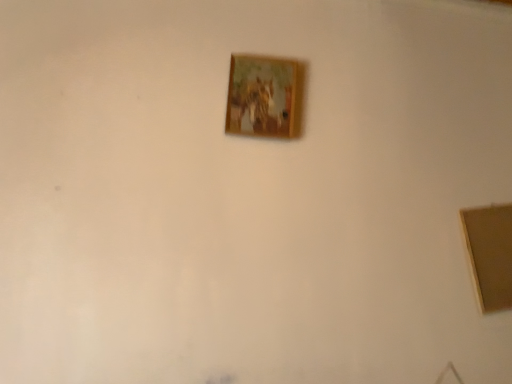
The height and width of the screenshot is (384, 512). Identify the location of wooden frame at center, which is the second picture frame in right-to-left order. (264, 97).

This screenshot has height=384, width=512. Describe the element at coordinates (264, 97) in the screenshot. I see `wooden frame at center, the first picture frame viewed from the top` at that location.

Where is `wooden picture frame at upper center, which appears as the 1th picture frame when viewed from the right`? Image resolution: width=512 pixels, height=384 pixels. wooden picture frame at upper center, which appears as the 1th picture frame when viewed from the right is located at coordinates (490, 254).

This screenshot has width=512, height=384. What do you see at coordinates (490, 254) in the screenshot? I see `wooden picture frame at upper center, placed as the 2th picture frame when sorted from left to right` at bounding box center [490, 254].

Find the location of a particular element. wooden frame at center, which appears as the second picture frame when ordered from the bottom is located at coordinates (264, 97).

Can you confirm if wooden frame at center, the first picture frame viewed from the top, is positioned to the right of wooden picture frame at upper center, marked as the 2th picture frame in a top-to-bottom arrangement?

Incorrect, wooden frame at center, the first picture frame viewed from the top, is not on the right side of wooden picture frame at upper center, marked as the 2th picture frame in a top-to-bottom arrangement.

Is the position of wooden frame at center, which is the second picture frame in right-to-left order, less distant than that of wooden picture frame at upper center, placed as the 2th picture frame when sorted from left to right?

No, wooden frame at center, which is the second picture frame in right-to-left order, is behind wooden picture frame at upper center, placed as the 2th picture frame when sorted from left to right.

Is point (256, 69) farther from viewer compared to point (508, 235)?

No.

From the image's perspective, is wooden frame at center, which appears as the second picture frame when ordered from the bottom, located beneath wooden picture frame at upper center, placed as the 2th picture frame when sorted from left to right?

Incorrect, from the image's perspective, wooden frame at center, which appears as the second picture frame when ordered from the bottom, is higher than wooden picture frame at upper center, placed as the 2th picture frame when sorted from left to right.

From a real-world perspective, does wooden frame at center, the 1th picture frame positioned from the left, sit lower than wooden picture frame at upper center, which appears as the 1th picture frame when viewed from the right?

No.

In the scene shown: Does wooden frame at center, the 1th picture frame positioned from the left, have a lesser width compared to wooden picture frame at upper center, the first picture frame ordered from the bottom?

Correct, the width of wooden frame at center, the 1th picture frame positioned from the left, is less than that of wooden picture frame at upper center, the first picture frame ordered from the bottom.

Which of these two, wooden frame at center, the 1th picture frame positioned from the left, or wooden picture frame at upper center, the first picture frame ordered from the bottom, stands taller?

wooden picture frame at upper center, the first picture frame ordered from the bottom, is taller.

Can you confirm if wooden frame at center, the first picture frame viewed from the top, is smaller than wooden picture frame at upper center, the first picture frame ordered from the bottom?

Yes, wooden frame at center, the first picture frame viewed from the top, is smaller than wooden picture frame at upper center, the first picture frame ordered from the bottom.

Is wooden frame at center, the 1th picture frame positioned from the left, outside of wooden picture frame at upper center, the first picture frame ordered from the bottom?

Yes, wooden frame at center, the 1th picture frame positioned from the left, is outside of wooden picture frame at upper center, the first picture frame ordered from the bottom.

Is wooden frame at center, the first picture frame viewed from the top, not close to wooden picture frame at upper center, marked as the 2th picture frame in a top-to-bottom arrangement?

They are positioned close to each other.

Is wooden frame at center, which is the second picture frame in right-to-left order, oriented towards wooden picture frame at upper center, placed as the 2th picture frame when sorted from left to right?

No, wooden frame at center, which is the second picture frame in right-to-left order, is not oriented towards wooden picture frame at upper center, placed as the 2th picture frame when sorted from left to right.

Measure the distance between wooden frame at center, the first picture frame viewed from the top, and wooden picture frame at upper center, which appears as the 1th picture frame when viewed from the right.

35.54 inches.

Find the location of `picture frame lying on the right of wooden frame at center, the first picture frame viewed from the top`. picture frame lying on the right of wooden frame at center, the first picture frame viewed from the top is located at coordinates (490, 254).

Considering the relative positions of wooden picture frame at upper center, placed as the 2th picture frame when sorted from left to right, and wooden frame at center, the 1th picture frame positioned from the left, in the image provided, is wooden picture frame at upper center, placed as the 2th picture frame when sorted from left to right, to the left or to the right of wooden frame at center, the 1th picture frame positioned from the left,?

From the image, it's evident that wooden picture frame at upper center, placed as the 2th picture frame when sorted from left to right, is to the right of wooden frame at center, the 1th picture frame positioned from the left.

Which object is closer to the camera taking this photo, wooden picture frame at upper center, which appears as the 1th picture frame when viewed from the right, or wooden frame at center, the first picture frame viewed from the top?

wooden picture frame at upper center, which appears as the 1th picture frame when viewed from the right.

Does point (480, 253) come farther from viewer compared to point (232, 60)?

Yes, point (480, 253) is farther from viewer.

From the image's perspective, is wooden picture frame at upper center, marked as the 2th picture frame in a top-to-bottom arrangement, positioned above or below wooden frame at center, the first picture frame viewed from the top?

From the image's perspective, wooden picture frame at upper center, marked as the 2th picture frame in a top-to-bottom arrangement, appears below wooden frame at center, the first picture frame viewed from the top.

From a real-world perspective, which is physically below, wooden picture frame at upper center, which appears as the 1th picture frame when viewed from the right, or wooden frame at center, the first picture frame viewed from the top?

wooden picture frame at upper center, which appears as the 1th picture frame when viewed from the right, is physically lower.

In the scene shown: Which of these two, wooden picture frame at upper center, the first picture frame ordered from the bottom, or wooden frame at center, which appears as the second picture frame when ordered from the bottom, is thinner?

wooden frame at center, which appears as the second picture frame when ordered from the bottom, is thinner.

Does wooden picture frame at upper center, placed as the 2th picture frame when sorted from left to right, have a greater height compared to wooden frame at center, which appears as the second picture frame when ordered from the bottom?

Yes, wooden picture frame at upper center, placed as the 2th picture frame when sorted from left to right, is taller than wooden frame at center, which appears as the second picture frame when ordered from the bottom.

Which of these two, wooden picture frame at upper center, which appears as the 1th picture frame when viewed from the right, or wooden frame at center, which is the second picture frame in right-to-left order, is bigger?

Bigger between the two is wooden picture frame at upper center, which appears as the 1th picture frame when viewed from the right.

Is wooden picture frame at upper center, marked as the 2th picture frame in a top-to-bottom arrangement, inside or outside of wooden frame at center, which is the second picture frame in right-to-left order?

wooden picture frame at upper center, marked as the 2th picture frame in a top-to-bottom arrangement, cannot be found inside wooden frame at center, which is the second picture frame in right-to-left order.

Are wooden picture frame at upper center, placed as the 2th picture frame when sorted from left to right, and wooden frame at center, which appears as the second picture frame when ordered from the bottom, far apart?

They are positioned close to each other.

Does wooden picture frame at upper center, which appears as the 1th picture frame when viewed from the right, turn towards wooden frame at center, which is the second picture frame in right-to-left order?

No, wooden picture frame at upper center, which appears as the 1th picture frame when viewed from the right, is not aimed at wooden frame at center, which is the second picture frame in right-to-left order.

How different are the orientations of wooden picture frame at upper center, the first picture frame ordered from the bottom, and wooden frame at center, which appears as the second picture frame when ordered from the bottom, in degrees?

wooden picture frame at upper center, the first picture frame ordered from the bottom, and wooden frame at center, which appears as the second picture frame when ordered from the bottom, are facing 0.946 degrees away from each other.

Measure the distance between wooden picture frame at upper center, the first picture frame ordered from the bottom, and wooden frame at center, which appears as the second picture frame when ordered from the bottom.

The distance of wooden picture frame at upper center, the first picture frame ordered from the bottom, from wooden frame at center, which appears as the second picture frame when ordered from the bottom, is 35.54 inches.

Where is `picture frame above the wooden picture frame at upper center, which appears as the 1th picture frame when viewed from the right (from the image's perspective)`? The image size is (512, 384). picture frame above the wooden picture frame at upper center, which appears as the 1th picture frame when viewed from the right (from the image's perspective) is located at coordinates (264, 97).

In order to click on picture frame that is on the right side of wooden frame at center, which is the second picture frame in right-to-left order in this screenshot , I will do `click(490, 254)`.

Image resolution: width=512 pixels, height=384 pixels. Find the location of `picture frame in front of the wooden frame at center, which appears as the second picture frame when ordered from the bottom`. picture frame in front of the wooden frame at center, which appears as the second picture frame when ordered from the bottom is located at coordinates (490, 254).